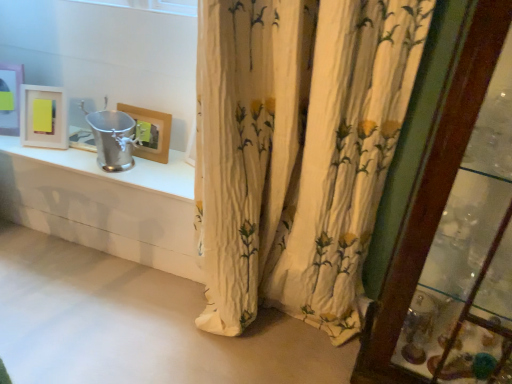
I want to click on wooden glass door at right, so click(x=432, y=194).

What do you see at coordinates (297, 151) in the screenshot?
I see `white floral fabric curtain at center` at bounding box center [297, 151].

Where is `matte white picture frame at upper left, which is counted as the third picture frame, starting from the right`? The width and height of the screenshot is (512, 384). matte white picture frame at upper left, which is counted as the third picture frame, starting from the right is located at coordinates (10, 98).

From a real-world perspective, is matte white picture frame at upper left, which is counted as the third picture frame, starting from the right, located higher than white floral fabric curtain at center?

Incorrect, from a real-world perspective, matte white picture frame at upper left, which is counted as the third picture frame, starting from the right, is lower than white floral fabric curtain at center.

Which is more to the right, matte white picture frame at upper left, which ranks as the 1th picture frame in left-to-right order, or white floral fabric curtain at center?

white floral fabric curtain at center.

Based on the photo, is matte white picture frame at upper left, which is counted as the third picture frame, starting from the right, not near white floral fabric curtain at center?

Absolutely, matte white picture frame at upper left, which is counted as the third picture frame, starting from the right, is distant from white floral fabric curtain at center.

What's the angular difference between white floral fabric curtain at center and matte wooden picture frame at upper center, marked as the third picture frame in a left-to-right arrangement,'s facing directions?

1.65 degrees separate the facing orientations of white floral fabric curtain at center and matte wooden picture frame at upper center, marked as the third picture frame in a left-to-right arrangement.

Is white floral fabric curtain at center not inside matte wooden picture frame at upper center, marked as the third picture frame in a left-to-right arrangement?

white floral fabric curtain at center lies outside matte wooden picture frame at upper center, marked as the third picture frame in a left-to-right arrangement,'s area.

Which is more to the left, white floral fabric curtain at center or matte wooden picture frame at upper center, the first picture frame in the right-to-left sequence?

From the viewer's perspective, matte wooden picture frame at upper center, the first picture frame in the right-to-left sequence, appears more on the left side.

Is point (206, 183) farther from viewer compared to point (41, 105)?

No, (206, 183) is closer to viewer.

Is white floral fabric curtain at center to the left of matte white picture frame at upper left, the second picture frame positioned from the left, from the viewer's perspective?

Incorrect, white floral fabric curtain at center is not on the left side of matte white picture frame at upper left, the second picture frame positioned from the left.

How many degrees apart are the facing directions of white floral fabric curtain at center and matte white picture frame at upper left, the second picture frame positioned from the left?

The facing directions of white floral fabric curtain at center and matte white picture frame at upper left, the second picture frame positioned from the left, are 17.9 degrees apart.

Would you say matte white picture frame at upper left, which ranks as the 1th picture frame in left-to-right order, is part of matte wooden picture frame at upper center, marked as the third picture frame in a left-to-right arrangement,'s contents?

No.

Considering the positions of objects matte wooden picture frame at upper center, marked as the third picture frame in a left-to-right arrangement, and matte white picture frame at upper left, which ranks as the 1th picture frame in left-to-right order, in the image provided, who is more to the left, matte wooden picture frame at upper center, marked as the third picture frame in a left-to-right arrangement, or matte white picture frame at upper left, which ranks as the 1th picture frame in left-to-right order,?

From the viewer's perspective, matte white picture frame at upper left, which ranks as the 1th picture frame in left-to-right order, appears more on the left side.

Considering their positions, is matte wooden picture frame at upper center, marked as the third picture frame in a left-to-right arrangement, located in front of or behind matte white picture frame at upper left, which ranks as the 1th picture frame in left-to-right order?

Clearly, matte wooden picture frame at upper center, marked as the third picture frame in a left-to-right arrangement, is in front of matte white picture frame at upper left, which ranks as the 1th picture frame in left-to-right order.

Which of these two, matte wooden picture frame at upper center, the first picture frame in the right-to-left sequence, or wooden glass door at right, is bigger?

wooden glass door at right.

Can you confirm if matte wooden picture frame at upper center, the first picture frame in the right-to-left sequence, is thinner than wooden glass door at right?

Indeed, matte wooden picture frame at upper center, the first picture frame in the right-to-left sequence, has a lesser width compared to wooden glass door at right.

How distant is matte wooden picture frame at upper center, the first picture frame in the right-to-left sequence, from wooden glass door at right?

matte wooden picture frame at upper center, the first picture frame in the right-to-left sequence, and wooden glass door at right are 1.06 meters apart.

From the image's perspective, is matte wooden picture frame at upper center, the first picture frame in the right-to-left sequence, below wooden glass door at right?

No, from the image's perspective, matte wooden picture frame at upper center, the first picture frame in the right-to-left sequence, is not beneath wooden glass door at right.

Is matte white picture frame at upper left, which is counted as the third picture frame, starting from the right, shorter than matte wooden picture frame at upper center, the first picture frame in the right-to-left sequence?

No, matte white picture frame at upper left, which is counted as the third picture frame, starting from the right, is not shorter than matte wooden picture frame at upper center, the first picture frame in the right-to-left sequence.

Is matte white picture frame at upper left, which ranks as the 1th picture frame in left-to-right order, wider or thinner than matte wooden picture frame at upper center, the first picture frame in the right-to-left sequence?

Clearly, matte white picture frame at upper left, which ranks as the 1th picture frame in left-to-right order, has more width compared to matte wooden picture frame at upper center, the first picture frame in the right-to-left sequence.

Based on the photo, can you tell me how much matte white picture frame at upper left, which is counted as the third picture frame, starting from the right, and matte wooden picture frame at upper center, the first picture frame in the right-to-left sequence, differ in facing direction?

They differ by 20 degrees in their facing directions.

Considering the positions of objects matte white picture frame at upper left, which ranks as the 1th picture frame in left-to-right order, and matte wooden picture frame at upper center, marked as the third picture frame in a left-to-right arrangement, in the image provided, who is more to the right, matte white picture frame at upper left, which ranks as the 1th picture frame in left-to-right order, or matte wooden picture frame at upper center, marked as the third picture frame in a left-to-right arrangement,?

matte wooden picture frame at upper center, marked as the third picture frame in a left-to-right arrangement, is more to the right.

Which is more to the right, matte white picture frame at upper left, which is counted as the third picture frame, starting from the right, or matte white picture frame at upper left, which is counted as the 2th picture frame, starting from the right?

matte white picture frame at upper left, which is counted as the 2th picture frame, starting from the right.

From a real-world perspective, is matte white picture frame at upper left, which is counted as the third picture frame, starting from the right, over matte white picture frame at upper left, the second picture frame positioned from the left?

Yes, from a real-world perspective, matte white picture frame at upper left, which is counted as the third picture frame, starting from the right, is over matte white picture frame at upper left, the second picture frame positioned from the left

From the image's perspective, would you say matte white picture frame at upper left, which is counted as the third picture frame, starting from the right, is positioned over matte white picture frame at upper left, which is counted as the 2th picture frame, starting from the right?

Correct, matte white picture frame at upper left, which is counted as the third picture frame, starting from the right, appears higher than matte white picture frame at upper left, which is counted as the 2th picture frame, starting from the right, in the image.

Which is correct: matte white picture frame at upper left, which is counted as the third picture frame, starting from the right, is inside matte white picture frame at upper left, the second picture frame positioned from the left, or outside of it?

matte white picture frame at upper left, which is counted as the third picture frame, starting from the right, lies outside matte white picture frame at upper left, the second picture frame positioned from the left.

Where is `picture frame that is the 3rd object located above the white floral fabric curtain at center (from the image's perspective)`? Image resolution: width=512 pixels, height=384 pixels. picture frame that is the 3rd object located above the white floral fabric curtain at center (from the image's perspective) is located at coordinates (10, 98).

This screenshot has height=384, width=512. What are the coordinates of `curtain on the right of the matte wooden picture frame at upper center, the first picture frame in the right-to-left sequence` in the screenshot? It's located at (297, 151).

Considering their positions, is wooden glass door at right positioned further to matte white picture frame at upper left, which is counted as the 2th picture frame, starting from the right, than white floral fabric curtain at center?

The object further to matte white picture frame at upper left, which is counted as the 2th picture frame, starting from the right, is wooden glass door at right.

Which object lies nearer to the anchor point matte white picture frame at upper left, which ranks as the 1th picture frame in left-to-right order, white floral fabric curtain at center or matte wooden picture frame at upper center, the first picture frame in the right-to-left sequence?

matte wooden picture frame at upper center, the first picture frame in the right-to-left sequence.

From the image, which object appears to be farther from white floral fabric curtain at center, matte white picture frame at upper left, which is counted as the third picture frame, starting from the right, or wooden glass door at right?

matte white picture frame at upper left, which is counted as the third picture frame, starting from the right, lies further to white floral fabric curtain at center than the other object.

Looking at the image, which one is located closer to matte white picture frame at upper left, which is counted as the 2th picture frame, starting from the right, wooden glass door at right or matte white picture frame at upper left, which is counted as the third picture frame, starting from the right?

Based on the image, matte white picture frame at upper left, which is counted as the third picture frame, starting from the right, appears to be nearer to matte white picture frame at upper left, which is counted as the 2th picture frame, starting from the right.

Estimate the real-world distances between objects in this image. Which object is further from wooden glass door at right, matte white picture frame at upper left, which is counted as the third picture frame, starting from the right, or white floral fabric curtain at center?

matte white picture frame at upper left, which is counted as the third picture frame, starting from the right.

In the scene shown: From the image, which object appears to be farther from matte wooden picture frame at upper center, the first picture frame in the right-to-left sequence, matte white picture frame at upper left, which is counted as the 2th picture frame, starting from the right, or matte white picture frame at upper left, which is counted as the third picture frame, starting from the right?

matte white picture frame at upper left, which is counted as the third picture frame, starting from the right, is positioned further to the anchor matte wooden picture frame at upper center, the first picture frame in the right-to-left sequence.

Considering their positions, is white floral fabric curtain at center positioned closer to matte white picture frame at upper left, the second picture frame positioned from the left, than wooden glass door at right?

white floral fabric curtain at center lies closer to matte white picture frame at upper left, the second picture frame positioned from the left, than the other object.

Looking at this image, when comparing their distances from wooden glass door at right, does white floral fabric curtain at center or matte white picture frame at upper left, which is counted as the 2th picture frame, starting from the right, seem closer?

white floral fabric curtain at center.

Identify the location of curtain located between wooden glass door at right and matte wooden picture frame at upper center, the first picture frame in the right-to-left sequence, in the depth direction. (297, 151).

Where is `picture frame between matte white picture frame at upper left, which is counted as the 2th picture frame, starting from the right, and wooden glass door at right, in the horizontal direction`? The width and height of the screenshot is (512, 384). picture frame between matte white picture frame at upper left, which is counted as the 2th picture frame, starting from the right, and wooden glass door at right, in the horizontal direction is located at coordinates (150, 132).

You are a GUI agent. You are given a task and a screenshot of the screen. Output one action in this format:
    pyautogui.click(x=<x>, y=<y>)
    Task: Click on the curtain located between matte white picture frame at upper left, which ranks as the 1th picture frame in left-to-right order, and wooden glass door at right in the left-right direction
    This screenshot has width=512, height=384.
    Given the screenshot: What is the action you would take?
    pyautogui.click(x=297, y=151)

At what (x,y) coordinates should I click in order to perform the action: click on curtain situated between matte white picture frame at upper left, which is counted as the 2th picture frame, starting from the right, and wooden glass door at right from left to right. Please return your answer as a coordinate pair (x, y). Image resolution: width=512 pixels, height=384 pixels. Looking at the image, I should click on (297, 151).